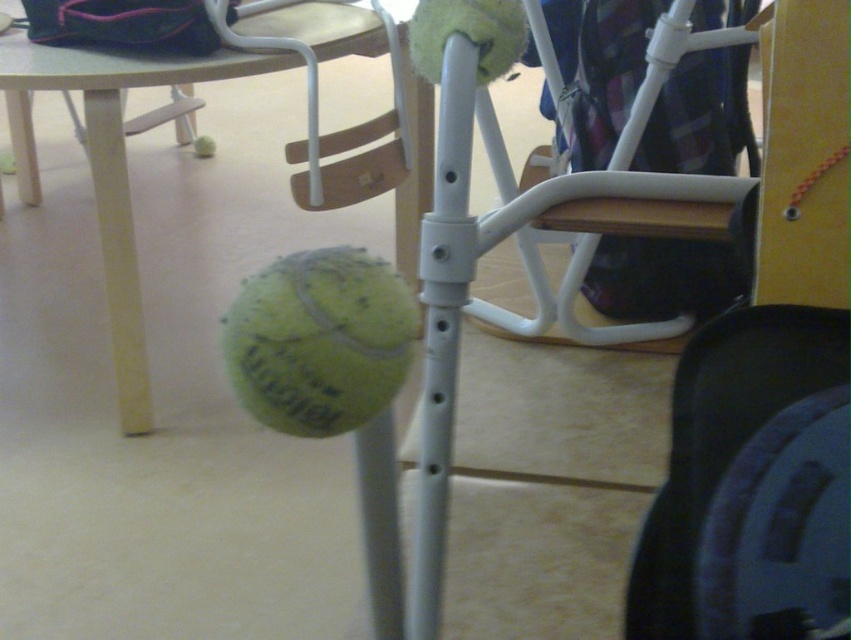
Is point (420, 45) closer to camera compared to point (207, 157)?

Yes, it is.

Who is shorter, yellow rubber tennis ball at center or yellow matte tennis ball at lower center?

yellow rubber tennis ball at center is shorter.

Identify the location of yellow rubber tennis ball at center. (467, 35).

Between white plastic chair at center and matte white table at center, which one appears on the right side from the viewer's perspective?

white plastic chair at center is more to the right.

Does white plastic chair at center appear on the right side of matte white table at center?

Indeed, white plastic chair at center is positioned on the right side of matte white table at center.

Does point (661, 26) lie in front of point (150, 396)?

That is True.

Where is `white plastic chair at center`? white plastic chair at center is located at coordinates (467, 298).

Which of these two, white plastic chair at center or yellow rubber tennis ball at center, stands taller?

white plastic chair at center is taller.

You are a GUI agent. You are given a task and a screenshot of the screen. Output one action in this format:
    pyautogui.click(x=<x>, y=<y>)
    Task: Click on the white plastic chair at center
    This screenshot has width=851, height=640.
    Given the screenshot: What is the action you would take?
    pyautogui.click(x=467, y=298)